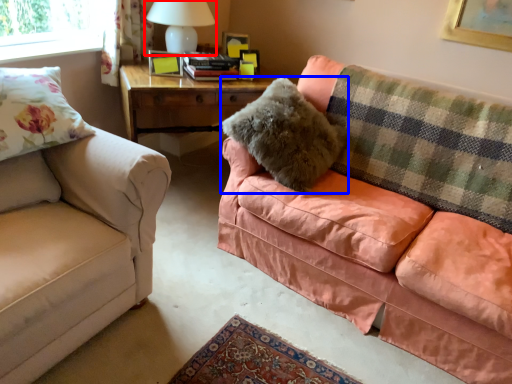
Question: Among these objects, which one is nearest to the camera, table lamp (highlighted by a red box) or pillow (highlighted by a blue box)?

Choices:
 (A) table lamp
 (B) pillow

Answer: (B)